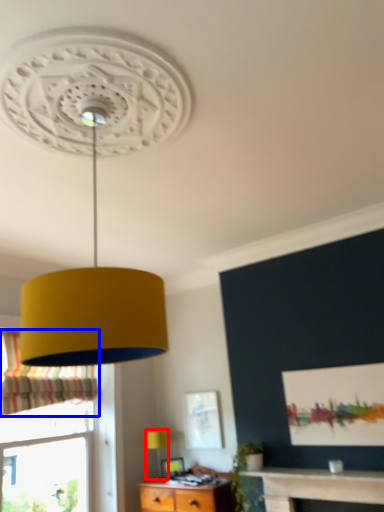
Question: Which object appears farthest to the camera in this image, table lamp (highlighted by a red box) or curtain (highlighted by a blue box)?

Choices:
 (A) table lamp
 (B) curtain

Answer: (A)